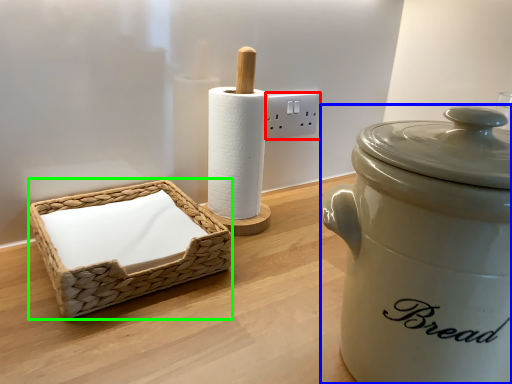
Question: Which object is the farthest from electric outlet (highlighted by a red box)? Choose among these: rice cooker (highlighted by a blue box) or basket (highlighted by a green box).

Choices:
 (A) rice cooker
 (B) basket

Answer: (A)